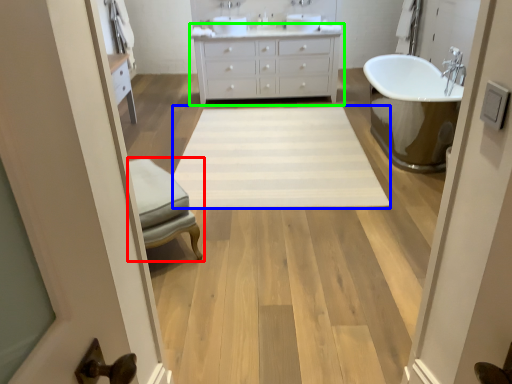
Question: Estimate the real-world distances between objects in this image. Which object is farther from furniture (highlighted by a red box), plain (highlighted by a blue box) or bathroom cabinet (highlighted by a green box)?

Choices:
 (A) plain
 (B) bathroom cabinet

Answer: (B)